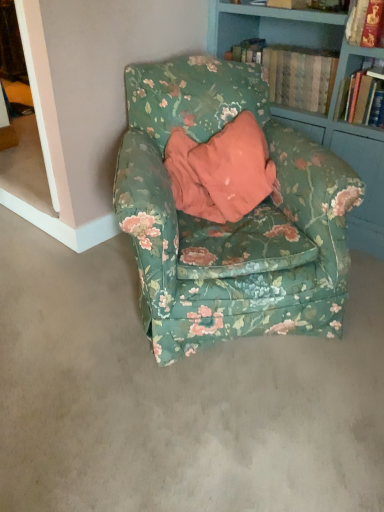
Question: Is hardcover book at upper right, marked as the first book in a left-to-right arrangement, looking in the opposite direction of hardcover book at upper right, placed as the 1th book when sorted from right to left?

Choices:
 (A) no
 (B) yes

Answer: (A)

Question: From the image's perspective, is hardcover book at upper right, marked as the first book in a left-to-right arrangement, on hardcover book at upper right, the second book from the left?

Choices:
 (A) yes
 (B) no

Answer: (A)

Question: Can you confirm if hardcover book at upper right, marked as the first book in a left-to-right arrangement, is taller than hardcover book at upper right, placed as the 1th book when sorted from right to left?

Choices:
 (A) no
 (B) yes

Answer: (A)

Question: Are hardcover book at upper right, the 2th book from the right, and hardcover book at upper right, placed as the 1th book when sorted from right to left, beside each other?

Choices:
 (A) yes
 (B) no

Answer: (B)

Question: Is hardcover book at upper right, placed as the 1th book when sorted from right to left, surrounded by hardcover book at upper right, marked as the first book in a left-to-right arrangement?

Choices:
 (A) yes
 (B) no

Answer: (B)

Question: Can you confirm if hardcover book at upper right, the 2th book from the right, is smaller than hardcover book at upper right, the second book from the left?

Choices:
 (A) no
 (B) yes

Answer: (A)

Question: Can you confirm if floral fabric armchair at center is smaller than hardcover book at upper right, marked as the first book in a left-to-right arrangement?

Choices:
 (A) no
 (B) yes

Answer: (A)

Question: Is floral fabric armchair at center facing towards hardcover book at upper right, marked as the first book in a left-to-right arrangement?

Choices:
 (A) yes
 (B) no

Answer: (B)

Question: Considering the relative sizes of floral fabric armchair at center and hardcover book at upper right, the 2th book from the right, in the image provided, is floral fabric armchair at center taller than hardcover book at upper right, the 2th book from the right,?

Choices:
 (A) yes
 (B) no

Answer: (B)

Question: Does floral fabric armchair at center lie behind hardcover book at upper right, marked as the first book in a left-to-right arrangement?

Choices:
 (A) no
 (B) yes

Answer: (A)

Question: From the image's perspective, is floral fabric armchair at center on hardcover book at upper right, the 2th book from the right?

Choices:
 (A) no
 (B) yes

Answer: (A)

Question: Is floral fabric armchair at center positioned beyond the bounds of hardcover book at upper right, the 2th book from the right?

Choices:
 (A) yes
 (B) no

Answer: (A)

Question: Is hardcover book at upper right, the 2th book from the right, oriented away from floral fabric armchair at center?

Choices:
 (A) yes
 (B) no

Answer: (B)